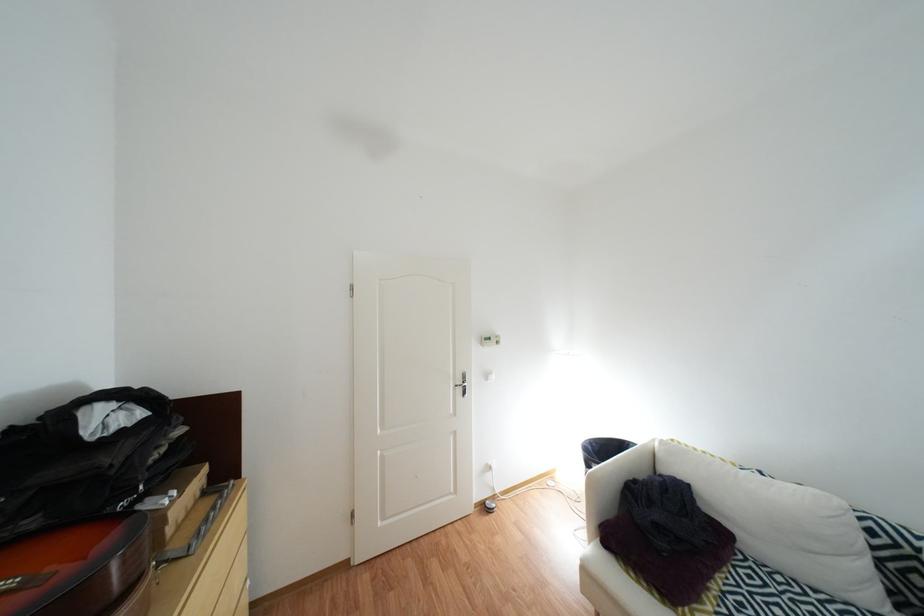
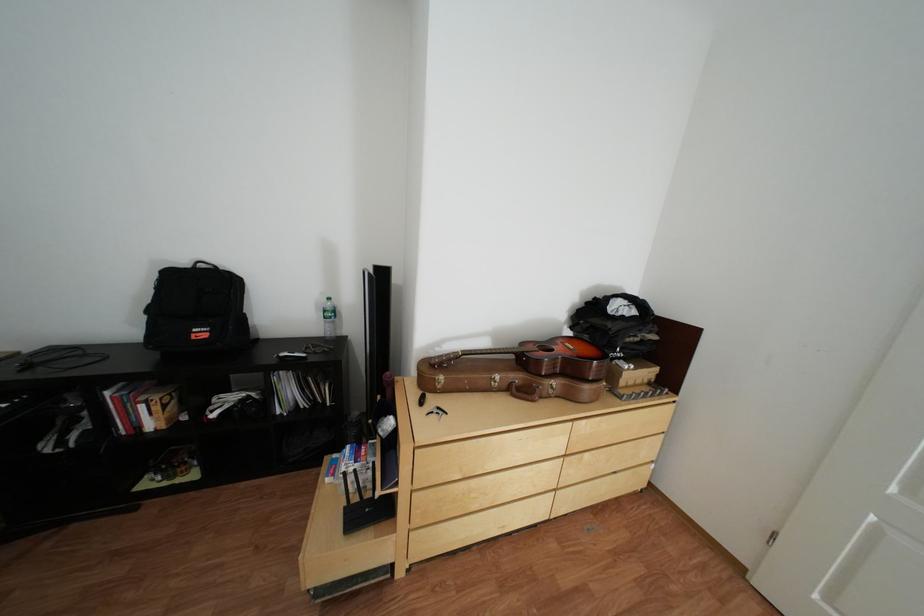
From the picture: How did the camera likely rotate?

The rotation direction of the camera is left-down.